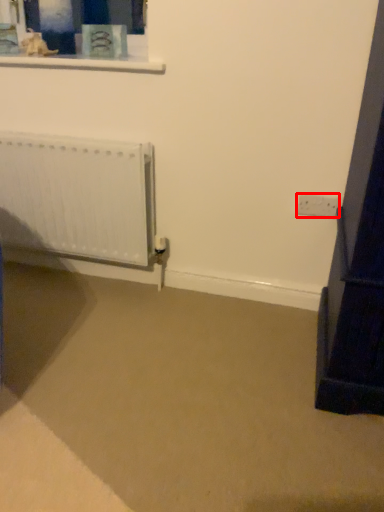
Question: Considering the relative positions of electric outlet (annotated by the red box) and radiator in the image provided, where is electric outlet (annotated by the red box) located with respect to the staircase?

Choices:
 (A) left
 (B) right

Answer: (B)